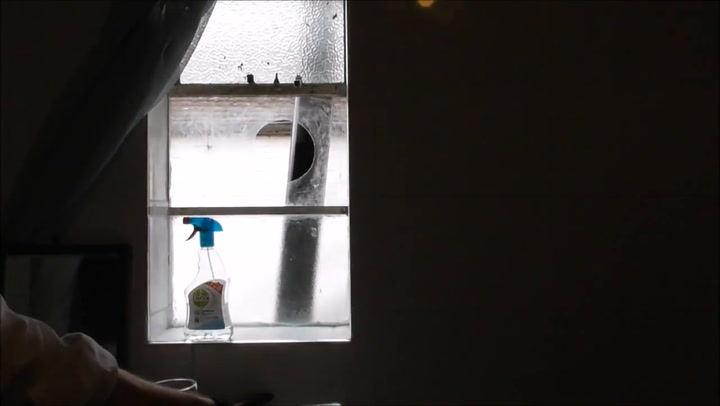
Find the location of a particular element. The image size is (720, 406). hole in window glass is located at coordinates (274, 149).